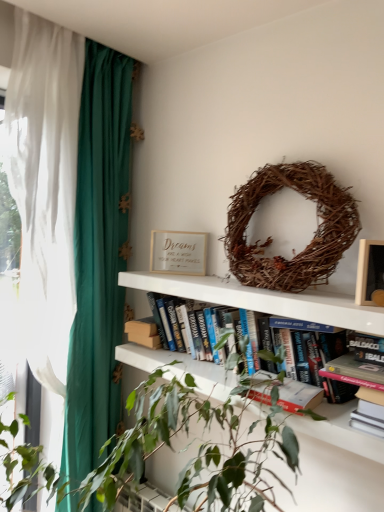
The width and height of the screenshot is (384, 512). I want to click on vacant point above hardcover books at center (from a real-world perspective), so click(263, 289).